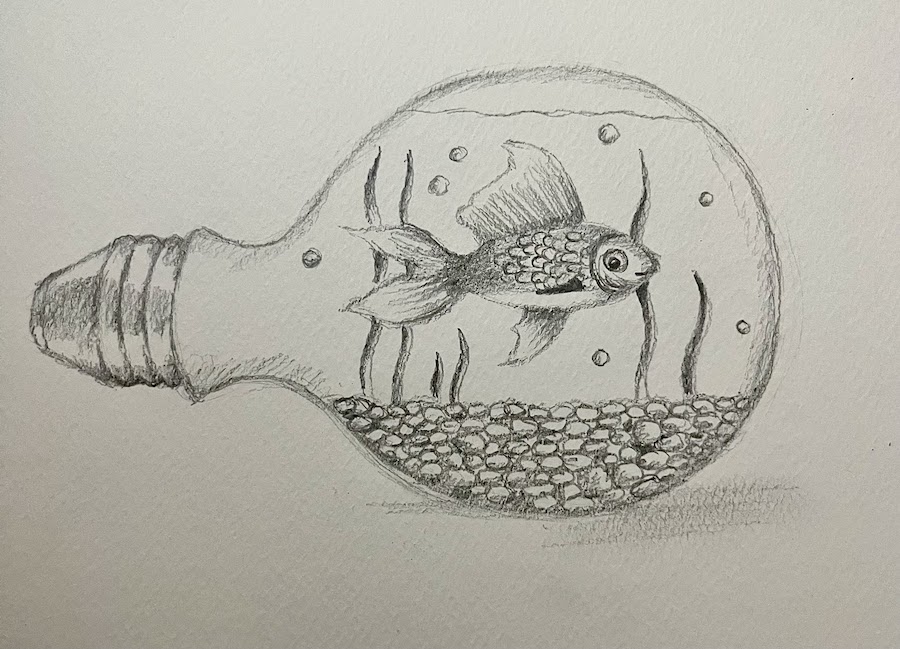
Where is `bulb`? The height and width of the screenshot is (649, 900). bulb is located at coordinates 148,298.